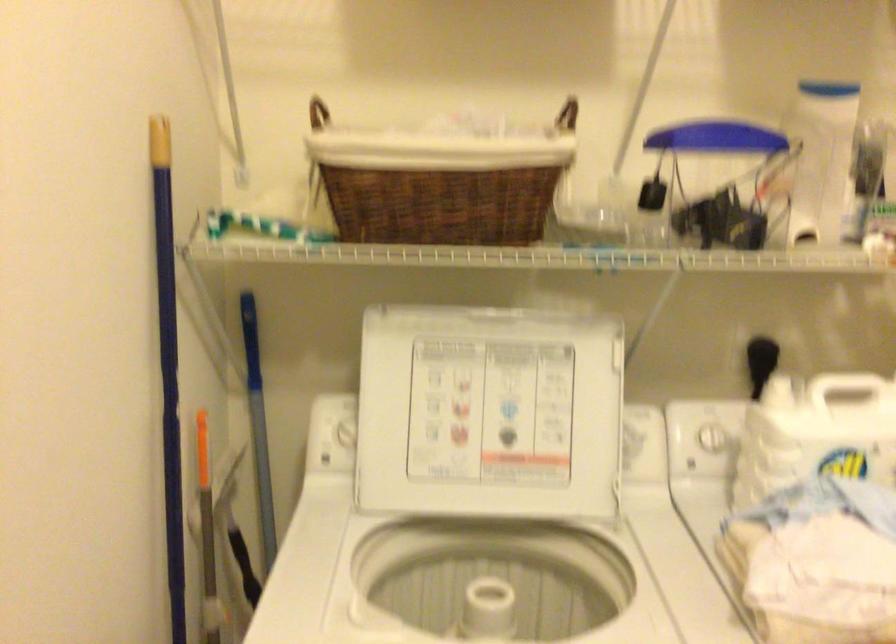
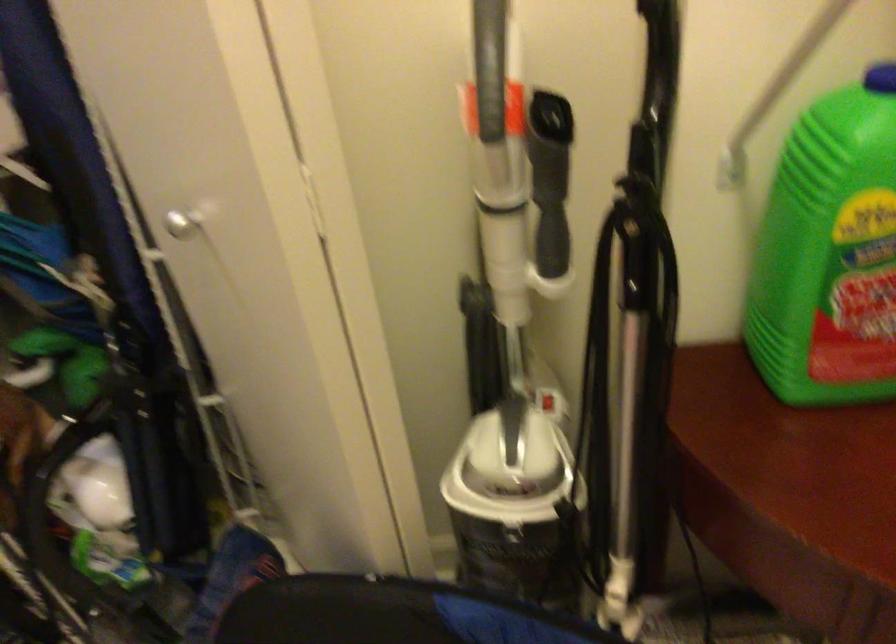
How did the camera likely rotate?

The camera's rotation is toward right-down.